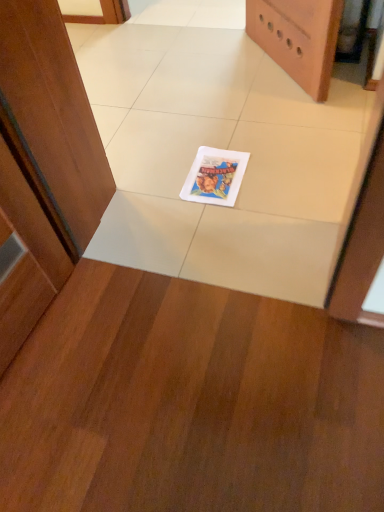
I want to click on vacant space behind matte white comic book at center, so click(x=207, y=133).